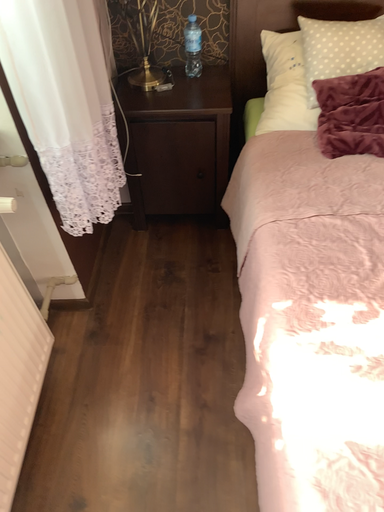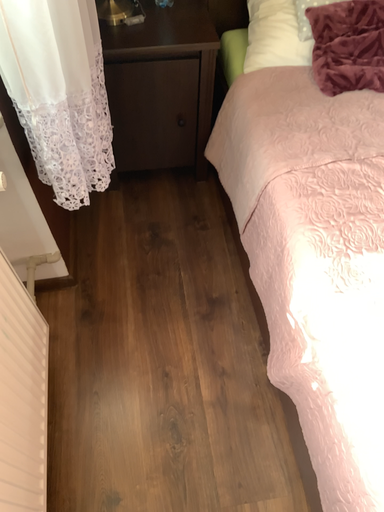
Question: Which way did the camera rotate in the video?

Choices:
 (A) rotated left
 (B) rotated right

Answer: (B)